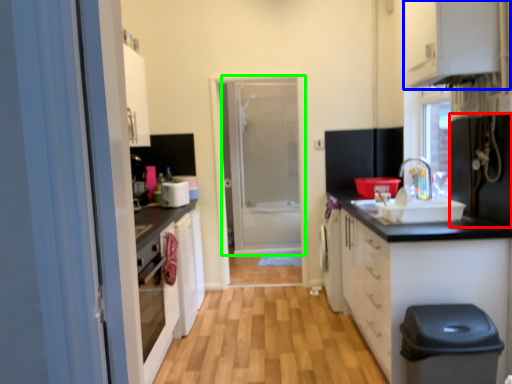
Question: Estimate the real-world distances between objects in this image. Which object is farther from appliance (highlighted by a red box), cabinetry (highlighted by a blue box) or door (highlighted by a green box)?

Choices:
 (A) cabinetry
 (B) door

Answer: (B)